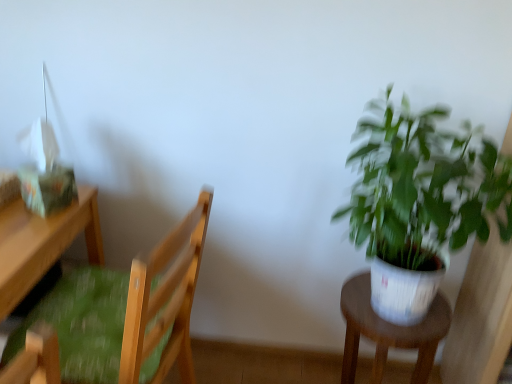
Question: From a real-world perspective, is white plastic stool at right on top of wooden chair with green cushion at left?

Choices:
 (A) yes
 (B) no

Answer: (B)

Question: Is white plastic stool at right looking in the opposite direction of wooden chair with green cushion at left?

Choices:
 (A) no
 (B) yes

Answer: (A)

Question: Would you consider white plastic stool at right to be distant from wooden chair with green cushion at left?

Choices:
 (A) yes
 (B) no

Answer: (B)

Question: Considering the relative sizes of white plastic stool at right and wooden chair with green cushion at left in the image provided, is white plastic stool at right smaller than wooden chair with green cushion at left?

Choices:
 (A) no
 (B) yes

Answer: (B)

Question: Is white plastic stool at right next to wooden chair with green cushion at left and touching it?

Choices:
 (A) no
 (B) yes

Answer: (A)

Question: From a real-world perspective, is white plastic stool at right located beneath wooden chair with green cushion at left?

Choices:
 (A) yes
 (B) no

Answer: (A)

Question: Considering the relative sizes of white plastic stool at right and wooden desk at left in the image provided, is white plastic stool at right shorter than wooden desk at left?

Choices:
 (A) yes
 (B) no

Answer: (A)

Question: Considering the relative sizes of white plastic stool at right and wooden desk at left in the image provided, is white plastic stool at right wider than wooden desk at left?

Choices:
 (A) no
 (B) yes

Answer: (A)

Question: Is white plastic stool at right not close to wooden desk at left?

Choices:
 (A) no
 (B) yes

Answer: (A)

Question: Is white plastic stool at right to the left of wooden desk at left from the viewer's perspective?

Choices:
 (A) yes
 (B) no

Answer: (B)

Question: Does white plastic stool at right lie in front of wooden desk at left?

Choices:
 (A) no
 (B) yes

Answer: (A)

Question: Is white plastic stool at right aimed at wooden desk at left?

Choices:
 (A) yes
 (B) no

Answer: (B)

Question: Is wooden desk at left not within green leafy plant at right?

Choices:
 (A) no
 (B) yes

Answer: (B)